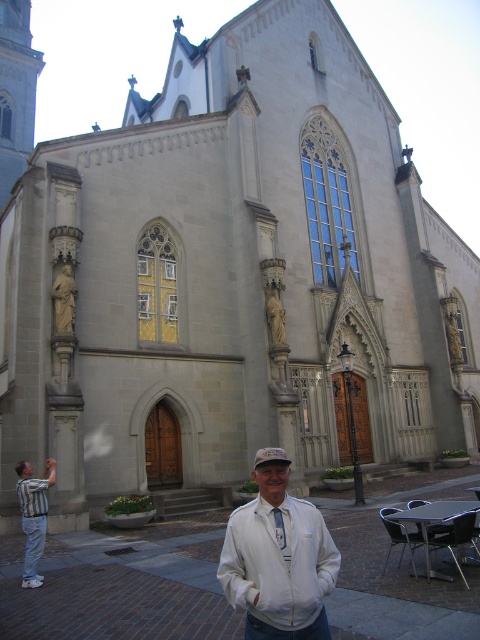
Question: Which of the following is the farthest from the observer?

Choices:
 (A) white matte jacket at center
 (B) striped fabric shirt at lower left
 (C) striped cotton shirt at lower left

Answer: (B)

Question: Does white matte jacket at center lie in front of striped fabric shirt at lower left?

Choices:
 (A) no
 (B) yes

Answer: (B)

Question: Does striped cotton shirt at lower left have a smaller size compared to striped fabric shirt at lower left?

Choices:
 (A) yes
 (B) no

Answer: (B)

Question: Does striped cotton shirt at lower left appear on the right side of striped fabric shirt at lower left?

Choices:
 (A) no
 (B) yes

Answer: (A)

Question: Estimate the real-world distances between objects in this image. Which object is closer to the white matte jacket at center?

Choices:
 (A) striped fabric shirt at lower left
 (B) striped cotton shirt at lower left

Answer: (B)

Question: Based on their relative distances, which object is farther from the white matte jacket at center?

Choices:
 (A) striped cotton shirt at lower left
 (B) striped fabric shirt at lower left

Answer: (B)